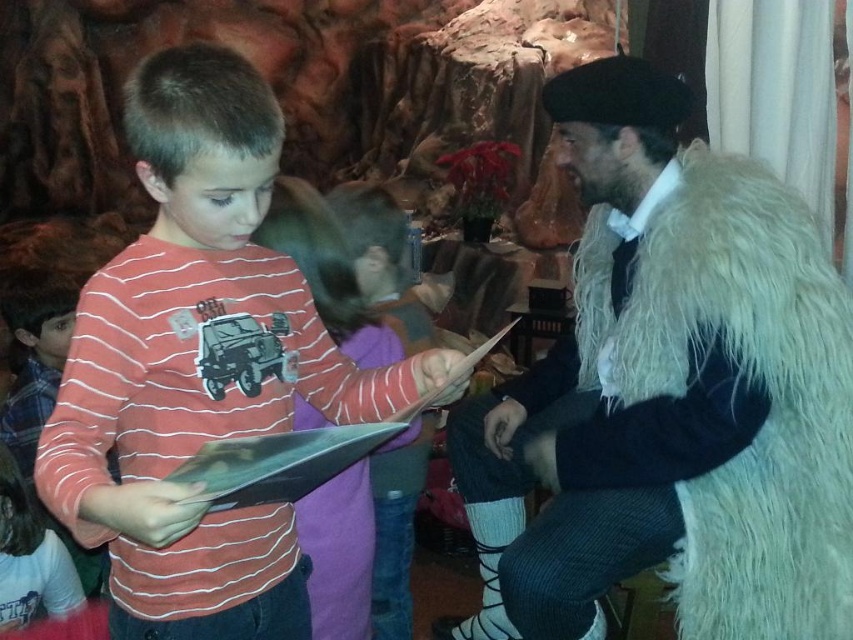
Question: Which point is farther to the camera?

Choices:
 (A) [x=828, y=317]
 (B) [x=236, y=225]

Answer: (A)

Question: Is striped cotton shirt at center to the right of white fluffy fur coat at right from the viewer's perspective?

Choices:
 (A) no
 (B) yes

Answer: (A)

Question: Which point is closer to the camera?

Choices:
 (A) (758, 458)
 (B) (399, 406)

Answer: (B)

Question: Is striped cotton shirt at center wider than white fluffy fur coat at right?

Choices:
 (A) no
 (B) yes

Answer: (A)

Question: Can you confirm if striped cotton shirt at center is wider than white fluffy fur coat at right?

Choices:
 (A) yes
 (B) no

Answer: (B)